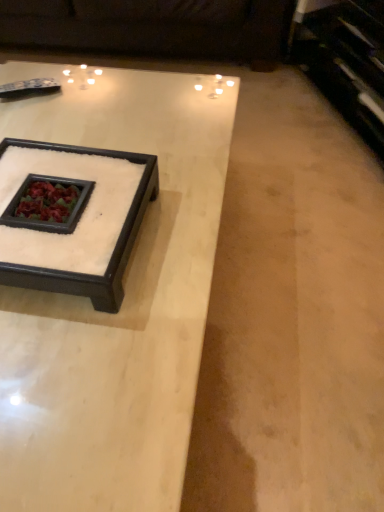
Question: From their relative heights in the image, would you say dark brown leather couch at upper center is taller or shorter than white marble coffee table at center, which ranks as the first coffee table in front-to-back order?

Choices:
 (A) tall
 (B) short

Answer: (B)

Question: Is dark brown leather couch at upper center wider or thinner than white marble coffee table at center, which ranks as the first coffee table in front-to-back order?

Choices:
 (A) thin
 (B) wide

Answer: (B)

Question: Which object is positioned farthest from the dark brown leather couch at upper center?

Choices:
 (A) white marble coffee table at center, which ranks as the first coffee table in front-to-back order
 (B) white marble tray at center, acting as the second coffee table starting from the front

Answer: (B)

Question: Estimate the real-world distances between objects in this image. Which object is farther from the dark brown leather couch at upper center?

Choices:
 (A) white marble tray at center, the first coffee table when ordered from back to front
 (B) white marble coffee table at center, which ranks as the first coffee table in front-to-back order

Answer: (A)